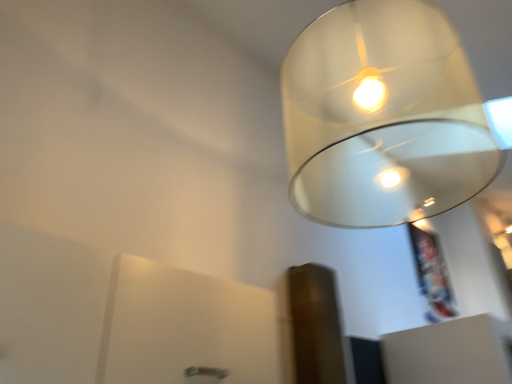
What do you see at coordinates (383, 117) in the screenshot?
I see `translucent white lampshade at upper center` at bounding box center [383, 117].

Where is `translucent white lampshade at upper center`? translucent white lampshade at upper center is located at coordinates (383, 117).

You are a GUI agent. You are given a task and a screenshot of the screen. Output one action in this format:
    pyautogui.click(x=<x>, y=<y>)
    Task: Click on the translucent white lampshade at upper center
    The image size is (512, 384).
    Given the screenshot: What is the action you would take?
    pyautogui.click(x=383, y=117)